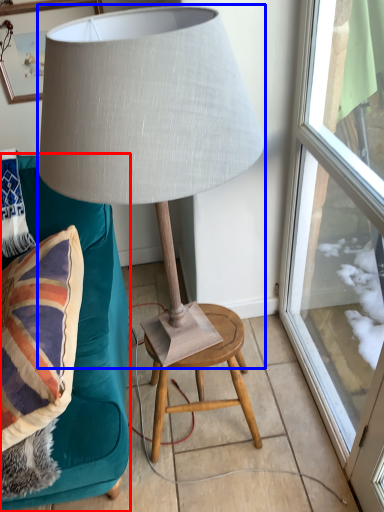
Question: Among these objects, which one is farthest to the camera, furniture (highlighted by a red box) or lamp (highlighted by a blue box)?

Choices:
 (A) furniture
 (B) lamp

Answer: (A)